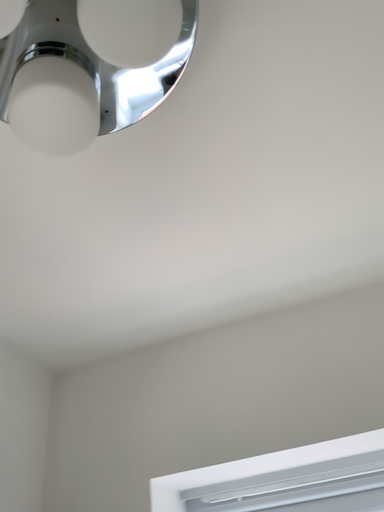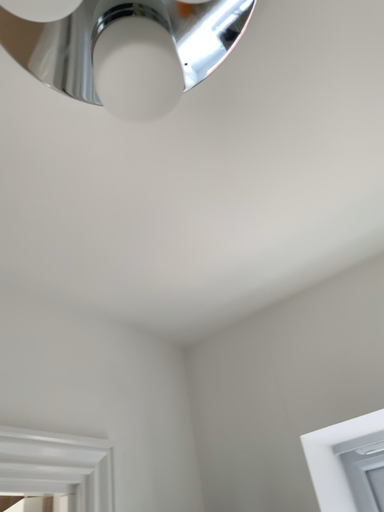
Question: Which way did the camera rotate in the video?

Choices:
 (A) rotated left
 (B) rotated right

Answer: (A)